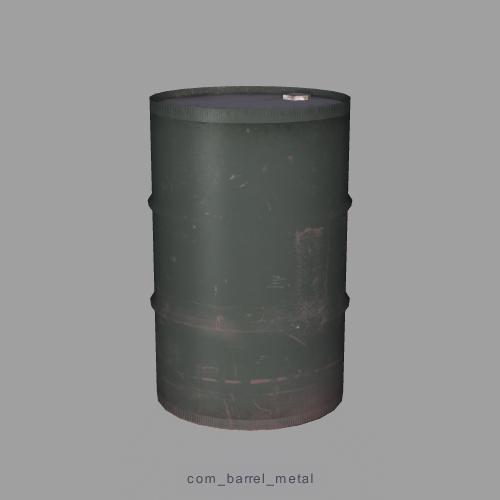
Find the location of `sticker residue`. sticker residue is located at coordinates (311, 263).